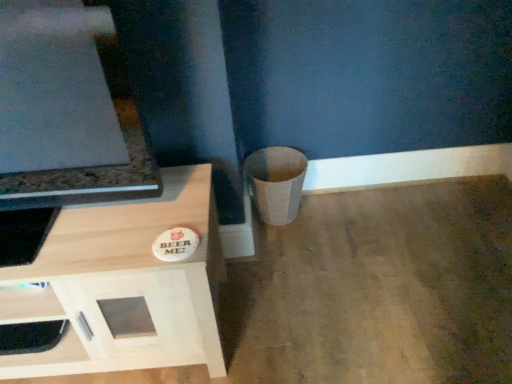
Locate an element on the screen. This screenshot has height=384, width=512. vacant space to the right of matte beige trash can at lower right is located at coordinates [x=337, y=216].